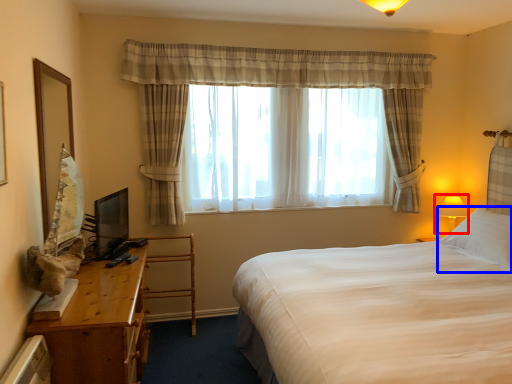
Question: Which object is further to the camera taking this photo, table lamp (highlighted by a red box) or pillow (highlighted by a blue box)?

Choices:
 (A) table lamp
 (B) pillow

Answer: (A)